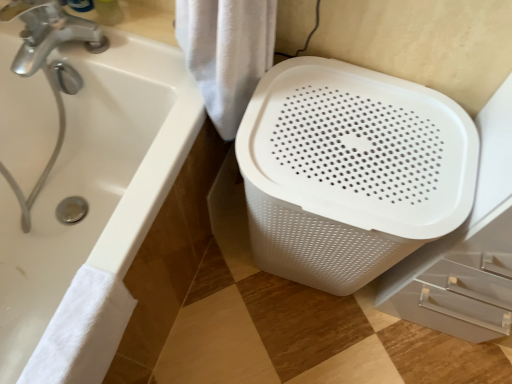
Question: Considering the relative sizes of white fabric towel at center, arranged as the 1th bath towel when viewed from the top, and white fluffy towel at lower left, the 1th bath towel ordered from the bottom, in the image provided, is white fabric towel at center, arranged as the 1th bath towel when viewed from the top, thinner than white fluffy towel at lower left, the 1th bath towel ordered from the bottom,?

Choices:
 (A) no
 (B) yes

Answer: (A)

Question: From the image's perspective, is white fabric towel at center, arranged as the 1th bath towel when viewed from the top, above white fluffy towel at lower left, placed as the 1th bath towel when sorted from left to right?

Choices:
 (A) yes
 (B) no

Answer: (A)

Question: Considering the relative positions of white fabric towel at center, the second bath towel positioned from the bottom, and white fluffy towel at lower left, positioned as the 2th bath towel in top-to-bottom order, in the image provided, is white fabric towel at center, the second bath towel positioned from the bottom, to the left of white fluffy towel at lower left, positioned as the 2th bath towel in top-to-bottom order, from the viewer's perspective?

Choices:
 (A) yes
 (B) no

Answer: (B)

Question: Considering the relative sizes of white fabric towel at center, the 2th bath towel positioned from the left, and white fluffy towel at lower left, placed as the 1th bath towel when sorted from left to right, in the image provided, is white fabric towel at center, the 2th bath towel positioned from the left, wider than white fluffy towel at lower left, placed as the 1th bath towel when sorted from left to right,?

Choices:
 (A) no
 (B) yes

Answer: (B)

Question: Considering the relative positions of white fabric towel at center, which is the 1th bath towel in right-to-left order, and white fluffy towel at lower left, the 1th bath towel ordered from the bottom, in the image provided, is white fabric towel at center, which is the 1th bath towel in right-to-left order, in front of white fluffy towel at lower left, the 1th bath towel ordered from the bottom,?

Choices:
 (A) yes
 (B) no

Answer: (B)

Question: Is white fabric towel at center, the 2th bath towel positioned from the left, to the right of white fluffy towel at lower left, the second bath towel in the right-to-left sequence, from the viewer's perspective?

Choices:
 (A) yes
 (B) no

Answer: (A)

Question: Is white fabric towel at center, arranged as the 1th bath towel when viewed from the top, at the back of white glossy bathtub at lower left?

Choices:
 (A) no
 (B) yes

Answer: (A)

Question: Is white glossy bathtub at lower left completely or partially outside of white fabric towel at center, which is the 1th bath towel in right-to-left order?

Choices:
 (A) yes
 (B) no

Answer: (A)

Question: From the image's perspective, is white glossy bathtub at lower left under white fabric towel at center, arranged as the 1th bath towel when viewed from the top?

Choices:
 (A) no
 (B) yes

Answer: (B)

Question: From a real-world perspective, is white glossy bathtub at lower left positioned over white fabric towel at center, the 2th bath towel positioned from the left, based on gravity?

Choices:
 (A) yes
 (B) no

Answer: (B)

Question: Considering the relative sizes of white glossy bathtub at lower left and white fabric towel at center, the second bath towel positioned from the bottom, in the image provided, is white glossy bathtub at lower left bigger than white fabric towel at center, the second bath towel positioned from the bottom,?

Choices:
 (A) yes
 (B) no

Answer: (A)

Question: Does white glossy bathtub at lower left appear on the left side of white fabric towel at center, arranged as the 1th bath towel when viewed from the top?

Choices:
 (A) yes
 (B) no

Answer: (A)

Question: Can you confirm if white fabric towel at center, the second bath towel positioned from the bottom, is shorter than white glossy bathtub at lower left?

Choices:
 (A) yes
 (B) no

Answer: (A)